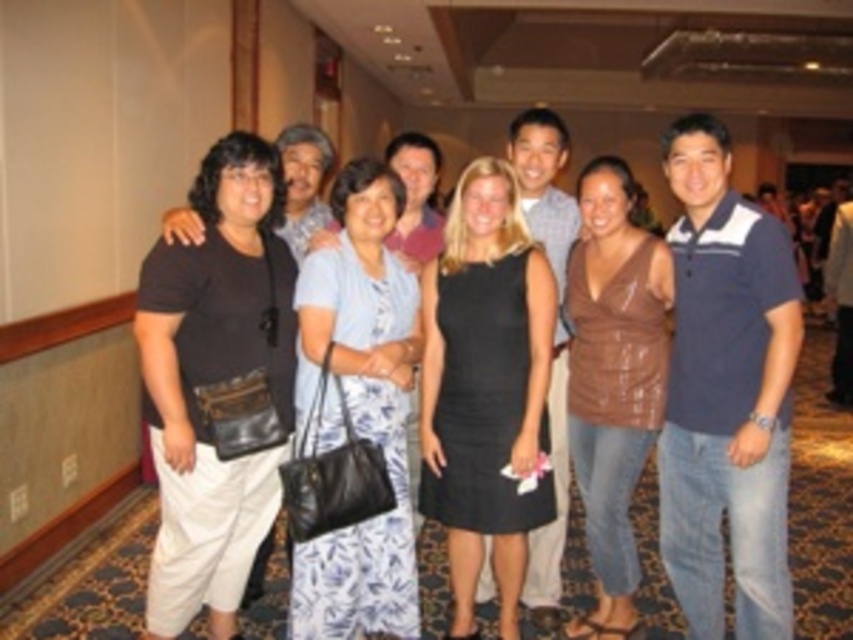
You are standing at the entrance of the corridor and want to take a photo of the black satin dress at center. Which direction should you move to get a clear view of it?

The black satin dress at center is located at point (485,387), so you should move towards the center of the corridor to get a clear view of it.

You are a photographer trying to adjust the lighting for the group photo. You notice the light blue floral dress at center and the brown leather top at center. Which one is positioned higher in the frame?

The light blue floral dress at center is located above the brown leather top at center, so it is positioned higher in the frame.

You are standing in the corridor and want to reach the point at coordinates point (402,324). If you take a step forward, will you be closer to the point or farther away?

The point (402,324) is 11.00 feet away from you. Taking a step forward would decrease the distance, so you would be closer to the point (402,324).